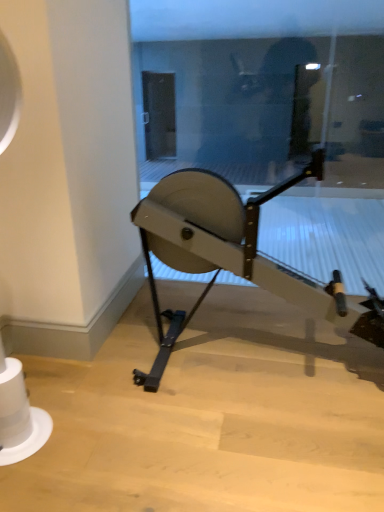
The height and width of the screenshot is (512, 384). Find the location of `free space below metallic silver exercise bike at center (from a real-world perspective)`. free space below metallic silver exercise bike at center (from a real-world perspective) is located at coordinates (268, 352).